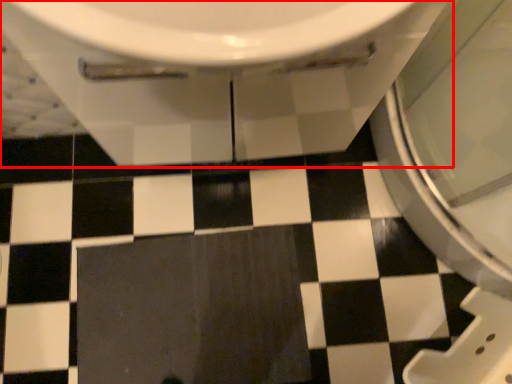
Question: Considering the relative positions of toilet (annotated by the red box) and ceramic tile in the image provided, where is toilet (annotated by the red box) located with respect to the staircase?

Choices:
 (A) right
 (B) left

Answer: (A)